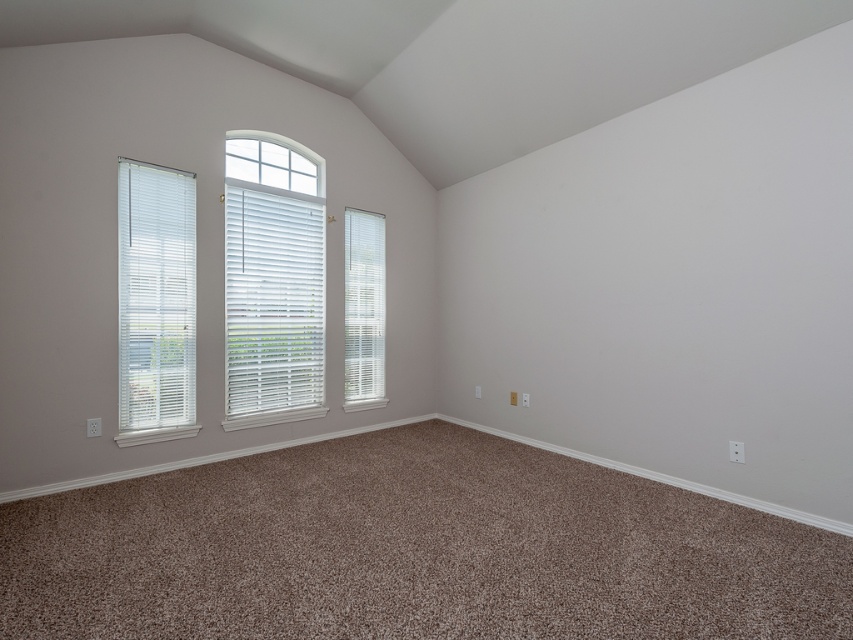
Does white wood blinds at center appear over white/smooth blinds at center?

Correct, white wood blinds at center is located above white/smooth blinds at center.

Does white wood blinds at center appear on the right side of white/smooth blinds at center?

Incorrect, white wood blinds at center is not on the right side of white/smooth blinds at center.

What do you see at coordinates (271, 301) in the screenshot? I see `white wood blinds at center` at bounding box center [271, 301].

I want to click on white wood blinds at center, so click(x=271, y=301).

Between white wood blinds at center and white plastic blinds at left, which one appears on the right side from the viewer's perspective?

white wood blinds at center

Who is more forward, (x=283, y=337) or (x=178, y=368)?

Positioned in front is point (x=178, y=368).

I want to click on white wood blinds at center, so click(x=271, y=301).

Does point (148, 292) lie in front of point (375, 364)?

Yes.

Who is lower down, white plastic blinds at left or white/smooth blinds at center?

white/smooth blinds at center is below.

Image resolution: width=853 pixels, height=640 pixels. In order to click on white plastic blinds at left in this screenshot , I will do `click(155, 296)`.